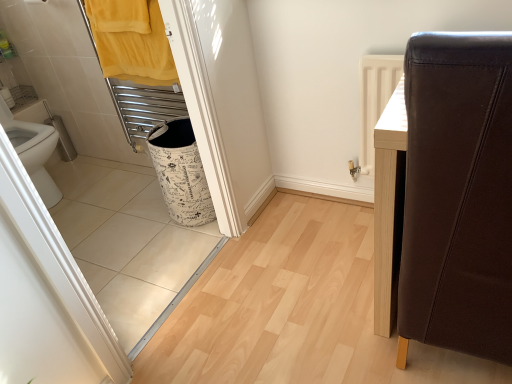
Question: Is yellow fabric towel at upper left directly adjacent to brown leather chair at right?

Choices:
 (A) yes
 (B) no

Answer: (B)

Question: Is yellow fabric towel at upper left facing away from brown leather chair at right?

Choices:
 (A) yes
 (B) no

Answer: (B)

Question: From a real-world perspective, is yellow fabric towel at upper left located higher than brown leather chair at right?

Choices:
 (A) yes
 (B) no

Answer: (A)

Question: From a real-world perspective, is yellow fabric towel at upper left beneath brown leather chair at right?

Choices:
 (A) yes
 (B) no

Answer: (B)

Question: Is brown leather chair at right surrounded by yellow fabric towel at upper left?

Choices:
 (A) yes
 (B) no

Answer: (B)

Question: Can you confirm if yellow fabric towel at upper left is positioned to the left of brown leather chair at right?

Choices:
 (A) yes
 (B) no

Answer: (A)

Question: Does white printed fabric laundry basket at lower left have a greater width compared to brown leather chair at right?

Choices:
 (A) no
 (B) yes

Answer: (A)

Question: Is white printed fabric laundry basket at lower left far away from brown leather chair at right?

Choices:
 (A) no
 (B) yes

Answer: (B)

Question: From the image's perspective, is white printed fabric laundry basket at lower left under brown leather chair at right?

Choices:
 (A) no
 (B) yes

Answer: (A)

Question: Is white printed fabric laundry basket at lower left oriented towards brown leather chair at right?

Choices:
 (A) no
 (B) yes

Answer: (A)

Question: Does white printed fabric laundry basket at lower left have a greater height compared to brown leather chair at right?

Choices:
 (A) no
 (B) yes

Answer: (A)

Question: Is white printed fabric laundry basket at lower left to the right of brown leather chair at right from the viewer's perspective?

Choices:
 (A) yes
 (B) no

Answer: (B)

Question: From a real-world perspective, is white printed fabric laundry basket at lower left located beneath yellow fabric towel at upper left?

Choices:
 (A) yes
 (B) no

Answer: (A)